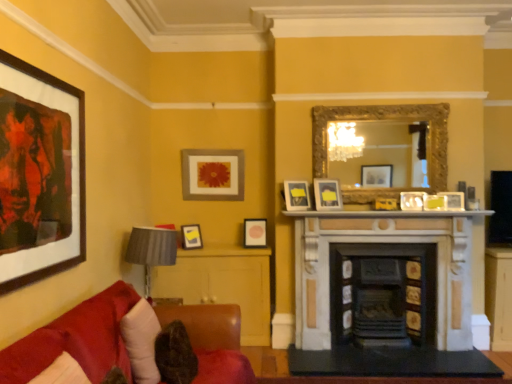
Question: From the image's perspective, is marble fireplace at center, positioned as the 2th fireplace in right-to-left order, above or below gold ornate mirror at upper center?

Choices:
 (A) above
 (B) below

Answer: (B)

Question: Looking at the image, does marble fireplace at center, positioned as the 2th fireplace in right-to-left order, seem bigger or smaller compared to gold ornate mirror at upper center?

Choices:
 (A) big
 (B) small

Answer: (A)

Question: Estimate the real-world distances between objects in this image. Which object is closer to the matte white picture frame at center-right, the second picture frame positioned from the front?

Choices:
 (A) gold ornate mirror at upper center
 (B) gray fabric lampshade at left
 (C) black marble table at center, marked as the 1th table in a bottom-to-top arrangement
 (D) matte black picture frame at center, acting as the 7th picture frame starting from the right
 (E) matte black picture frame at left, positioned as the eighth picture frame in back-to-front order

Answer: (A)

Question: Considering the real-world distances, which object is closest to the gray fabric lampshade at left?

Choices:
 (A) matte white picture frame at center, which is counted as the 4th picture frame, starting from the back
 (B) gold ornate mirror at upper center
 (C) marble fireplace at center, which is the 1th fireplace in left-to-right order
 (D) wooden cabinet at lower center, the 2th table from the front
 (E) matte gold picture frame at upper center, marked as the 6th picture frame in a right-to-left arrangement

Answer: (D)